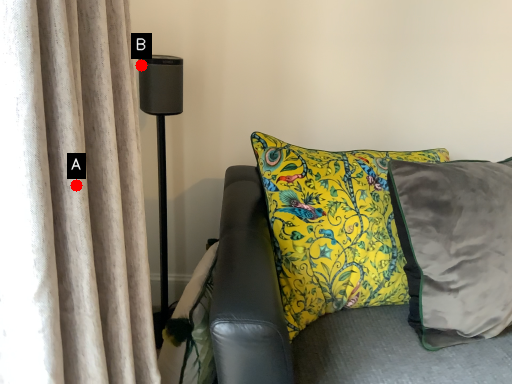
Question: Two points are circled on the image, labeled by A and B beside each circle. Among these points, which one is farthest from the camera?

Choices:
 (A) A is further
 (B) B is further

Answer: (B)